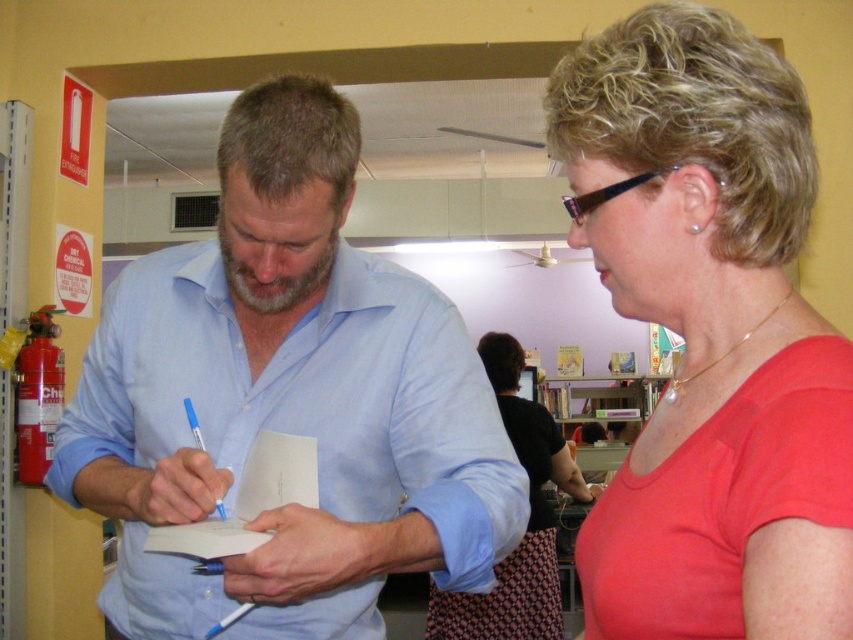
You are standing in the bookstore and want to reach the point marked as point (364, 465). The path to this point is 1.12 meters long. If your walking speed is 0.5 meters per second, how many seconds will it take you to reach the point?

The path to point (364, 465) is 1.12 meters long. At a speed of 0.5 meters per second, it will take 2.24 seconds to reach the point.

You are an interior designer assessing the layout of this bookstore. You notice the matte red shirt at center and the wooden bookshelf at center. Which object takes up more horizontal space in the scene?

The wooden bookshelf at center takes up more horizontal space because its width is greater than the matte red shirt at center.

You are standing at the entrance of the bookstore and want to ask the person in the blue shirt at center a question. However, you notice another person wearing a matte red shirt at center. Which individual should you approach first to ensure you can reach them without going around others?

You should approach the blue shirt at center first because the matte red shirt at center is behind it, so you can reach the blue shirt at center directly without needing to go around anyone.